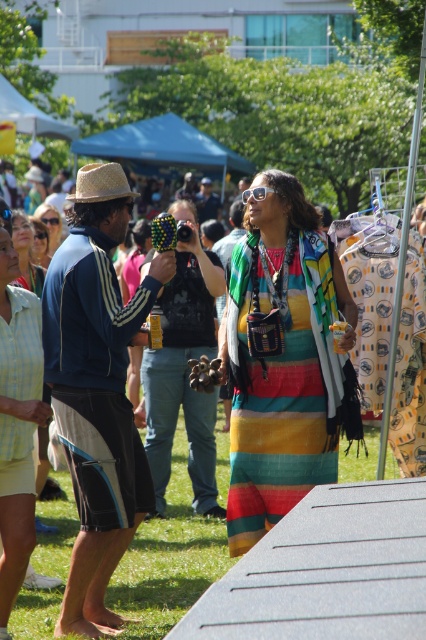
From the picture: Which of these two, multicolored striped dress at center or matte black sunglasses at upper center, stands shorter?

Standing shorter between the two is matte black sunglasses at upper center.

Between multicolored striped dress at center and matte black sunglasses at upper center, which one is positioned higher?

Positioned higher is matte black sunglasses at upper center.

At what (x,y) coordinates should I click in order to perform the action: click on multicolored striped dress at center. Please return your answer as a coordinate pair (x, y). The height and width of the screenshot is (640, 426). Looking at the image, I should click on (282, 358).

Identify the location of multicolored striped dress at center. This screenshot has height=640, width=426. (282, 358).

Does multicolored striped dress at center have a greater width compared to green grass at lower center?

Yes, multicolored striped dress at center is wider than green grass at lower center.

Is multicolored striped dress at center behind green grass at lower center?

No, multicolored striped dress at center is in front of green grass at lower center.

This screenshot has width=426, height=640. I want to click on multicolored striped dress at center, so click(x=282, y=358).

Which is more to the right, green grass at lower center or matte black sunglasses at upper center?

green grass at lower center is more to the right.

Looking at this image, does green grass at lower center have a smaller size compared to matte black sunglasses at upper center?

Yes, green grass at lower center is smaller than matte black sunglasses at upper center.

Locate an element on the screen. The width and height of the screenshot is (426, 640). green grass at lower center is located at coordinates (169, 557).